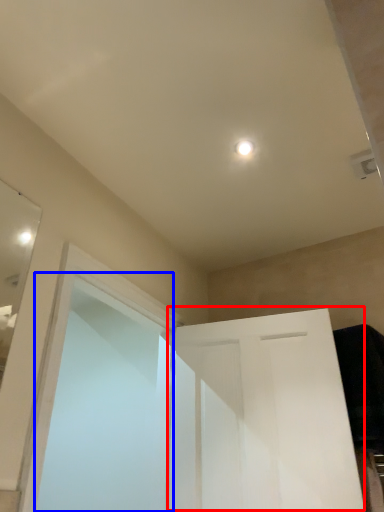
Question: Which object is closer to the camera taking this photo, door (highlighted by a red box) or screen door (highlighted by a blue box)?

Choices:
 (A) door
 (B) screen door

Answer: (B)